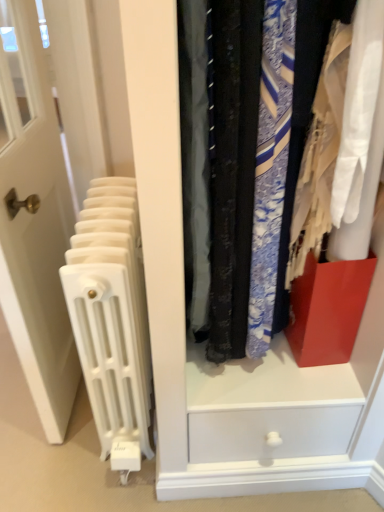
The height and width of the screenshot is (512, 384). Identify the location of vacant area that is in front of white glossy door at left. (53, 466).